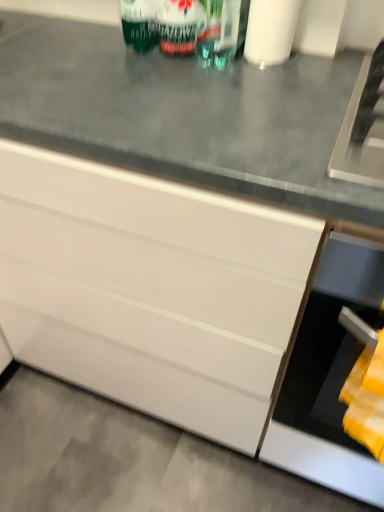
Question: From the image's perspective, relative to gray concrete floor at lower left, is green matte can at upper center above or below?

Choices:
 (A) below
 (B) above

Answer: (B)

Question: Based on their positions, is green matte can at upper center located to the left or right of gray concrete floor at lower left?

Choices:
 (A) left
 (B) right

Answer: (B)

Question: Which is farther from the white matte toilet paper at upper center?

Choices:
 (A) green glass wine bottle at upper center
 (B) yellow fabric at lower right
 (C) gray concrete floor at lower left
 (D) green matte can at upper center
 (E) black matte oven at lower right

Answer: (C)

Question: Which object is positioned farthest from the white glossy cabinet at center?

Choices:
 (A) green glass wine bottle at upper center
 (B) black matte oven at lower right
 (C) white matte toilet paper at upper center
 (D) gray concrete floor at lower left
 (E) green matte can at upper center

Answer: (C)